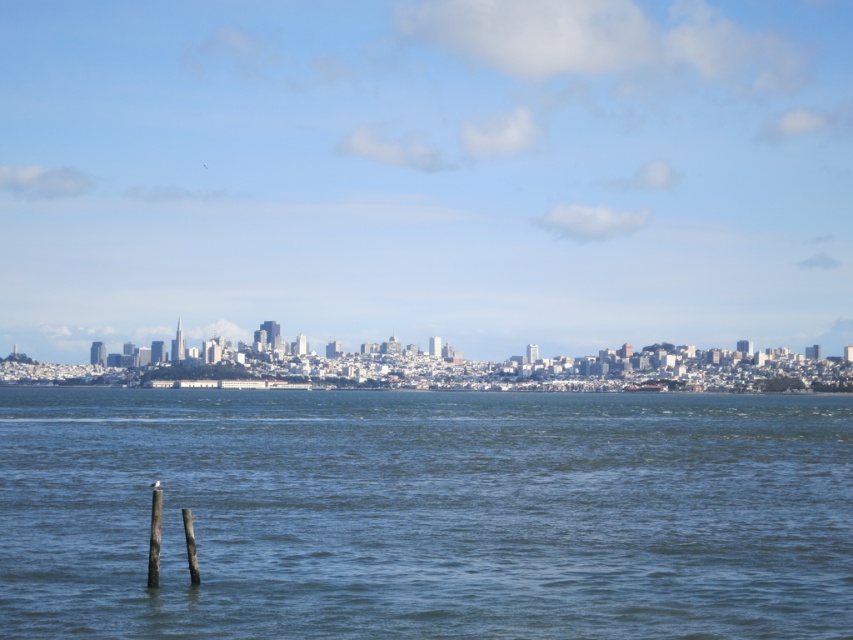
Question: Which object appears farthest from the camera in this image?

Choices:
 (A) wooden post at lower left
 (B) metallic gray ship at center
 (C) blue water at center

Answer: (B)

Question: Can you confirm if blue water at center is positioned to the left of wooden post at lower left?

Choices:
 (A) no
 (B) yes

Answer: (A)

Question: Is blue water at center further to camera compared to wooden post at lower left?

Choices:
 (A) no
 (B) yes

Answer: (A)

Question: Which object is positioned farthest from the blue water at center?

Choices:
 (A) metallic gray ship at center
 (B) wooden post at lower left

Answer: (B)

Question: Which of the following is the farthest from the observer?

Choices:
 (A) (157, 577)
 (B) (651, 392)
 (C) (16, 458)

Answer: (B)

Question: Can you confirm if blue water at center is smaller than wooden post at lower left?

Choices:
 (A) no
 (B) yes

Answer: (A)